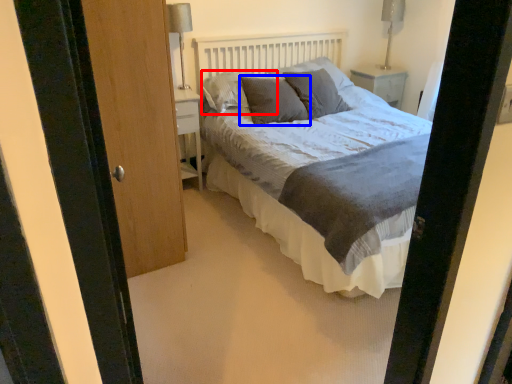
Question: Which object is further to the camera taking this photo, pillow (highlighted by a red box) or pillow (highlighted by a blue box)?

Choices:
 (A) pillow
 (B) pillow

Answer: (A)